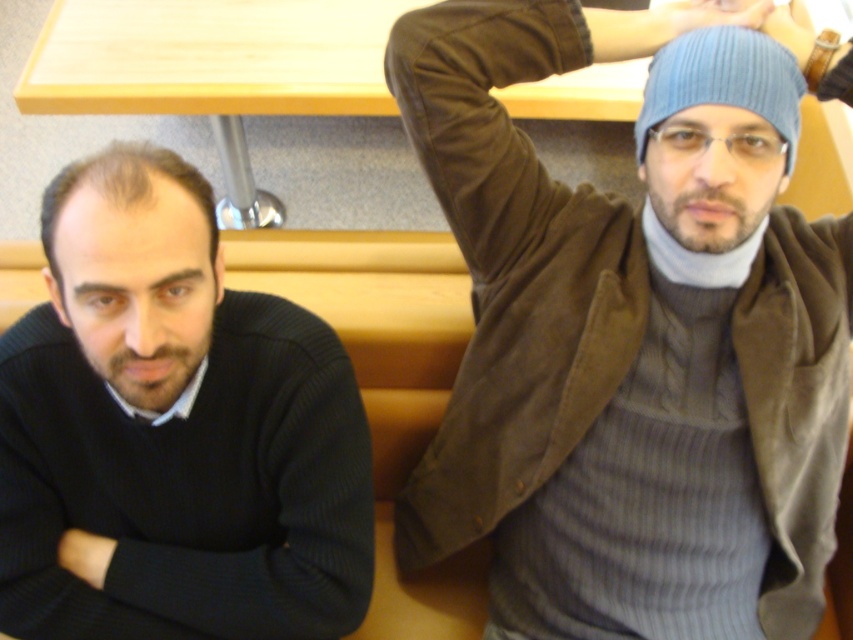
Consider the image. Is ribbed knit sweater at upper right below blue ribbed knit beanie at upper right?

Indeed, ribbed knit sweater at upper right is positioned under blue ribbed knit beanie at upper right.

Does ribbed knit sweater at upper right have a larger size compared to blue ribbed knit beanie at upper right?

Yes.

The width and height of the screenshot is (853, 640). I want to click on ribbed knit sweater at upper right, so click(630, 339).

Is ribbed knit sweater at upper right taller than black ribbed sweater at left?

Correct, ribbed knit sweater at upper right is much taller as black ribbed sweater at left.

In the scene shown: Can you confirm if ribbed knit sweater at upper right is thinner than black ribbed sweater at left?

In fact, ribbed knit sweater at upper right might be wider than black ribbed sweater at left.

Is point (563, 376) closer to viewer compared to point (167, 150)?

No, it is not.

Where is `ribbed knit sweater at upper right`? ribbed knit sweater at upper right is located at coordinates (630, 339).

This screenshot has width=853, height=640. What do you see at coordinates (630, 339) in the screenshot? I see `ribbed knit sweater at upper right` at bounding box center [630, 339].

Does ribbed knit sweater at upper right appear over matte black sweater at left?

Yes.

Is point (795, 284) farther from viewer compared to point (49, 291)?

Yes, point (795, 284) is farther from viewer.

You are a GUI agent. You are given a task and a screenshot of the screen. Output one action in this format:
    pyautogui.click(x=<x>, y=<y>)
    Task: Click on the ribbed knit sweater at upper right
    
    Given the screenshot: What is the action you would take?
    pyautogui.click(x=630, y=339)